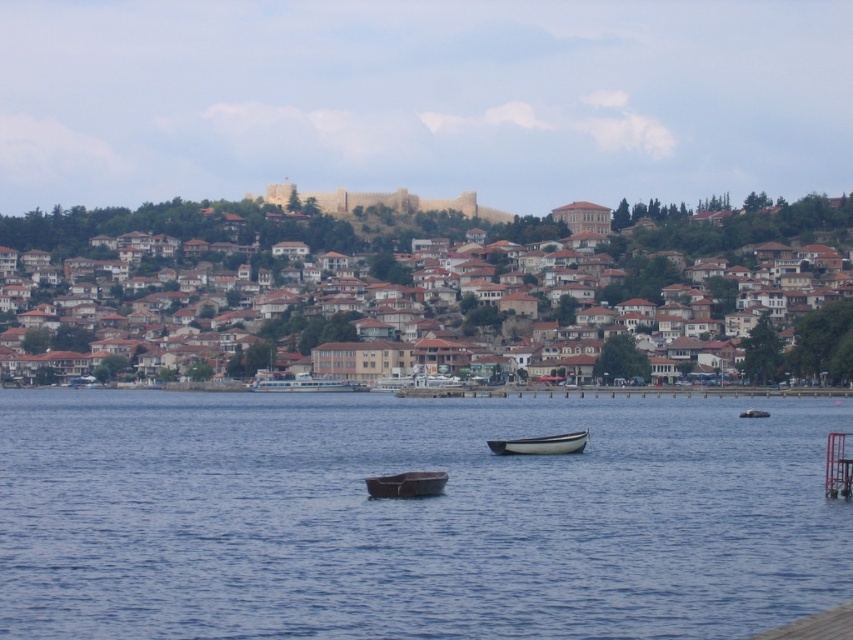
Who is shorter, wooden boat at center or white glossy ferry at center?

Standing shorter between the two is wooden boat at center.

Is wooden boat at center thinner than white glossy ferry at center?

Yes.

Identify the location of wooden boat at center. (405, 484).

Between blue water at center and wooden boat at center, which one appears on the left side from the viewer's perspective?

wooden boat at center

The width and height of the screenshot is (853, 640). What do you see at coordinates (412, 516) in the screenshot?
I see `blue water at center` at bounding box center [412, 516].

What do you see at coordinates (412, 516) in the screenshot? I see `blue water at center` at bounding box center [412, 516].

This screenshot has width=853, height=640. What are the coordinates of `blue water at center` in the screenshot? It's located at (412, 516).

Find the location of a particular element. The height and width of the screenshot is (640, 853). white plastic boat at center is located at coordinates (540, 444).

Is point (514, 442) more distant than point (750, 412)?

No, it is not.

Between point (572, 449) and point (749, 413), which one is positioned in front?

Point (572, 449) is in front.

Where is `white plastic boat at center`? The image size is (853, 640). white plastic boat at center is located at coordinates (540, 444).